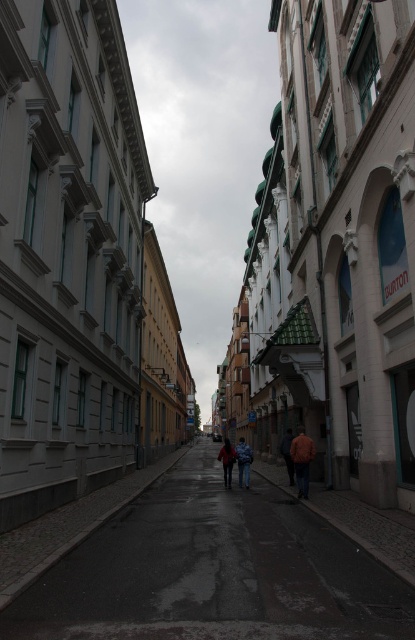
Who is more forward, (239,458) or (229,461)?

Point (239,458) is in front.

Based on the photo, who is lower down, blue denim jacket at center or dark blue jeans at center?

blue denim jacket at center

Is point (244, 458) positioned behind point (219, 452)?

That is False.

Find the location of a particular element. This screenshot has height=640, width=415. blue denim jacket at center is located at coordinates (244, 461).

Does orange leather jacket at center appear on the left side of dark blue jeans at center?

No, orange leather jacket at center is not to the left of dark blue jeans at center.

Based on the photo, is orange leather jacket at center to the right of dark blue jeans at center from the viewer's perspective?

Correct, you'll find orange leather jacket at center to the right of dark blue jeans at center.

Is point (302, 451) more distant than point (227, 442)?

No, (302, 451) is in front of (227, 442).

This screenshot has width=415, height=640. In order to click on orange leather jacket at center in this screenshot , I will do `click(302, 460)`.

Who is more distant from viewer, (297, 461) or (288, 483)?

The point (288, 483) is behind.

Does orange leather jacket at center appear on the right side of orange fabric jacket at center?

In fact, orange leather jacket at center is to the left of orange fabric jacket at center.

Who is more distant from viewer, (x=298, y=429) or (x=288, y=442)?

Point (x=298, y=429)

I want to click on orange leather jacket at center, so click(302, 460).